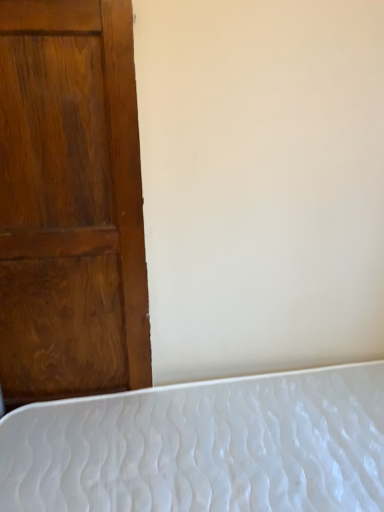
Question: Considering the relative sizes of white textured mattress at lower left and shiny brown wood door at left in the image provided, is white textured mattress at lower left shorter than shiny brown wood door at left?

Choices:
 (A) yes
 (B) no

Answer: (A)

Question: Is white textured mattress at lower left wider than shiny brown wood door at left?

Choices:
 (A) no
 (B) yes

Answer: (B)

Question: Can shiny brown wood door at left be found inside white textured mattress at lower left?

Choices:
 (A) no
 (B) yes

Answer: (A)

Question: Is white textured mattress at lower left to the left of shiny brown wood door at left from the viewer's perspective?

Choices:
 (A) no
 (B) yes

Answer: (A)

Question: Can you confirm if white textured mattress at lower left is bigger than shiny brown wood door at left?

Choices:
 (A) no
 (B) yes

Answer: (B)

Question: Is white textured mattress at lower left with shiny brown wood door at left?

Choices:
 (A) no
 (B) yes

Answer: (A)

Question: Is shiny brown wood door at left wider than white textured mattress at lower left?

Choices:
 (A) no
 (B) yes

Answer: (A)

Question: Considering the relative positions of shiny brown wood door at left and white textured mattress at lower left in the image provided, is shiny brown wood door at left in front of white textured mattress at lower left?

Choices:
 (A) yes
 (B) no

Answer: (B)

Question: Is shiny brown wood door at left taller than white textured mattress at lower left?

Choices:
 (A) no
 (B) yes

Answer: (B)

Question: Would you say shiny brown wood door at left contains white textured mattress at lower left?

Choices:
 (A) no
 (B) yes

Answer: (A)

Question: Is shiny brown wood door at left turned away from white textured mattress at lower left?

Choices:
 (A) no
 (B) yes

Answer: (A)

Question: Considering the relative sizes of shiny brown wood door at left and white textured mattress at lower left in the image provided, is shiny brown wood door at left thinner than white textured mattress at lower left?

Choices:
 (A) no
 (B) yes

Answer: (B)

Question: In terms of width, does white textured mattress at lower left look wider or thinner when compared to shiny brown wood door at left?

Choices:
 (A) wide
 (B) thin

Answer: (A)